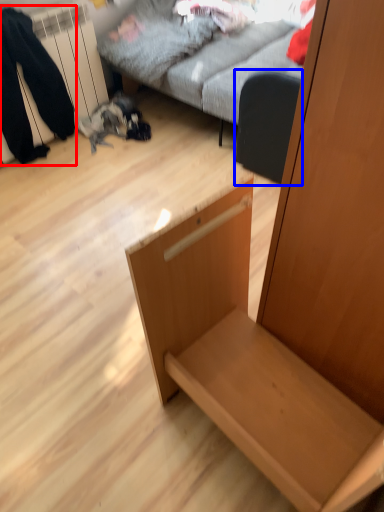
Question: Among these objects, which one is nearest to the camera, couple (highlighted by a red box) or swivel chair (highlighted by a blue box)?

Choices:
 (A) couple
 (B) swivel chair

Answer: (A)